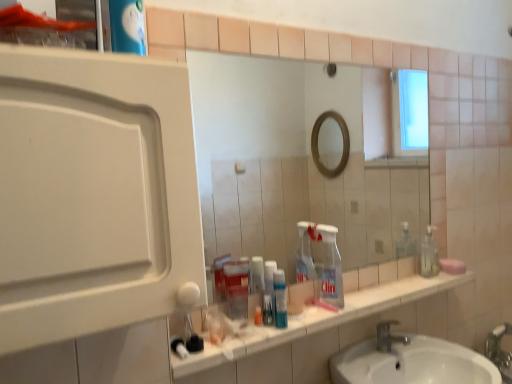
Question: From the image's perspective, is silver metallic faucet at lower center positioned above or below translucent plastic toothpaste at center, the first bottle when ordered from right to left?

Choices:
 (A) below
 (B) above

Answer: (A)

Question: Is silver metallic faucet at lower center spatially inside translucent plastic toothpaste at center, which is the first bottle in back-to-front order, or outside of it?

Choices:
 (A) outside
 (B) inside

Answer: (A)

Question: Which object is the closest to the translucent plastic toothpaste at center, the first bottle when ordered from right to left?

Choices:
 (A) clear plastic bottle at center
 (B) translucent plastic container at center, which is the 2th bottle in right-to-left order
 (C) silver metallic faucet at lower center
 (D) pink matte soap at right
 (E) white matte medicine cabinet at left

Answer: (B)

Question: Estimate the real-world distances between objects in this image. Which object is closer to the translucent plastic container at center, which ranks as the 2th bottle in back-to-front order?

Choices:
 (A) white glossy sink at lower center
 (B) white matte medicine cabinet at left
 (C) silver metallic faucet at lower center
 (D) translucent plastic toothpaste at center, which ranks as the 2th bottle in front-to-back order
 (E) clear plastic bottle at center

Answer: (D)